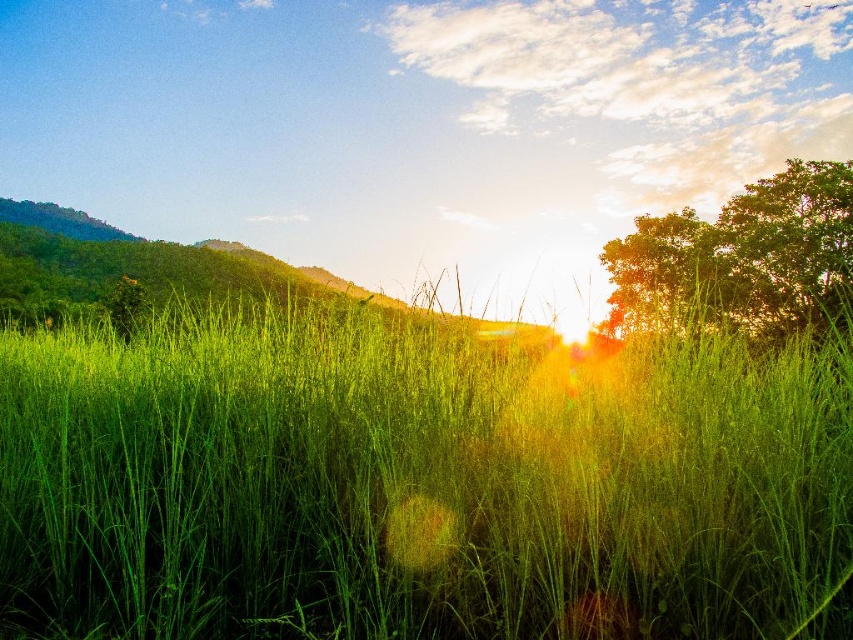
You are standing in the field of tall grass and see two points in the scene. The first point is at coordinates point (344, 374) and the second is at point (695, 282). Which point is closer to you?

Point (344, 374) is in front of point (695, 282), so it is closer to you.

You are an artist planning to paint the landscape scene. You want to ensure the green grassy at center and green leafy tree at upper right are proportionally accurate. Which object should you paint larger in your artwork?

The green leafy tree at upper right should be painted larger than the green grassy at center because it occupies more space in the scene according to the description.

You are a hiker who wants to take a photo of the green leafy tree at upper right and the green grassy hillside at center. If your camera can focus on objects up to 15 meters away, will both objects be in focus?

The distance between the green leafy tree at upper right and the green grassy hillside at center is 14.28 meters. Since the camera can focus up to 15 meters, both objects will be in focus as the distance between them is within the camera range.